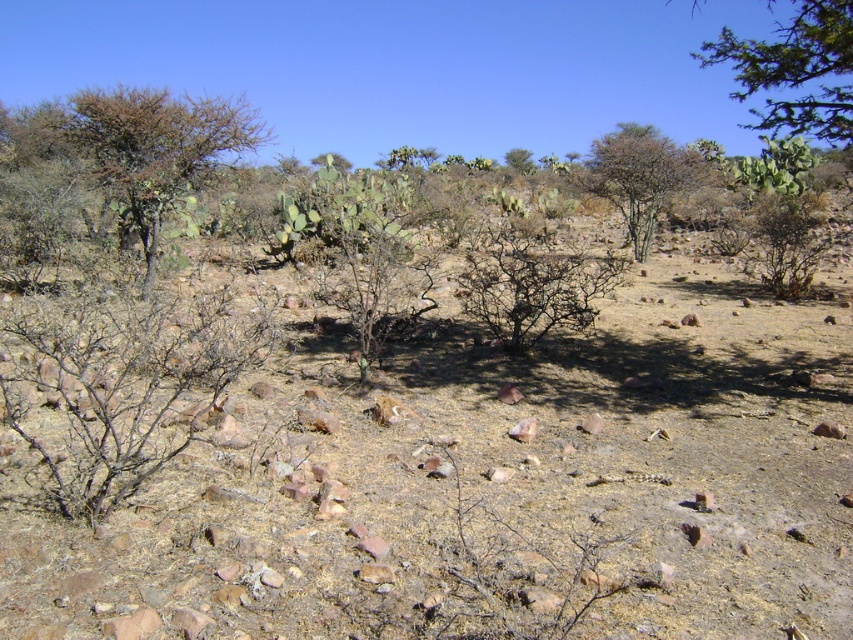
You are a hiker in the desert and need to identify plants for survival. You see a brown dry bush at center and a green leafy shrub at center. Which one is more likely to provide shade?

The green leafy shrub at center is larger in size compared to the brown dry bush at center, so it can provide more shade.

You are a hiker trying to navigate the desert terrain. You have two landmarks marked on your map as point coordinates. The first is at point (761, 320) and the second at point (496, 236). Which point is closer to you when you look at the desert scene?

Point (761, 320) is closer to the viewer than point (496, 236).

You are a hiker trying to navigate through this desert landscape. You notice a brown dry bush at center and a green leafy shrub at center. Which of these two plants is taller?

The green leafy shrub at center is taller than the brown dry bush at center according to the description.